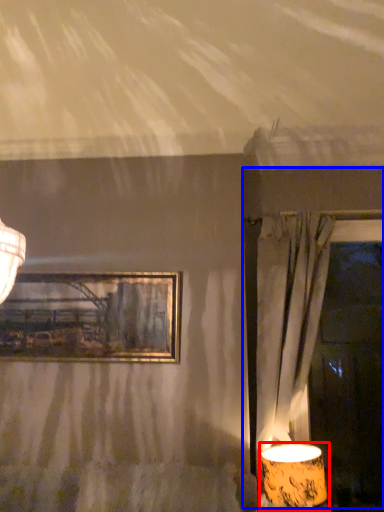
Question: Which object appears farthest to the camera in this image, lamp (highlighted by a red box) or window frame (highlighted by a blue box)?

Choices:
 (A) lamp
 (B) window frame

Answer: (B)